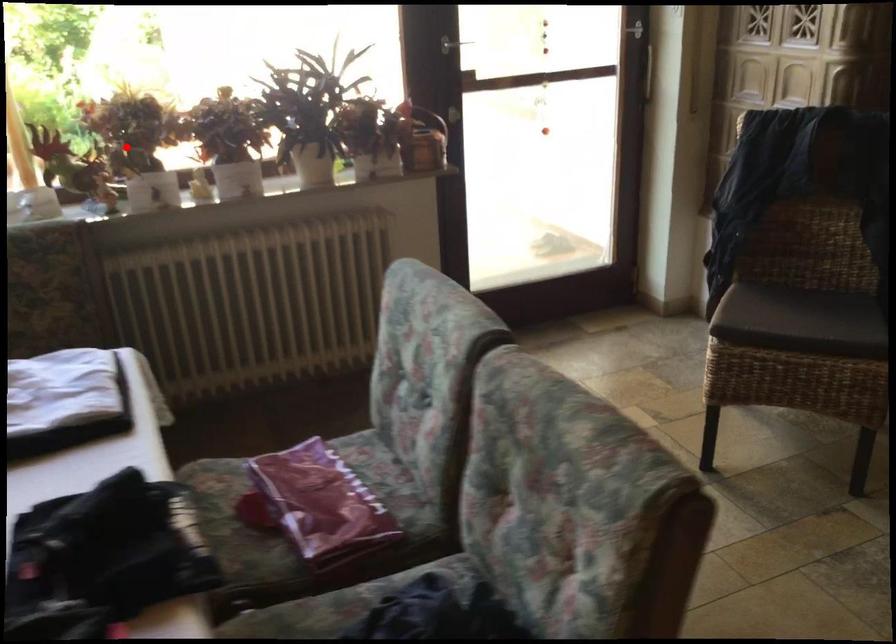
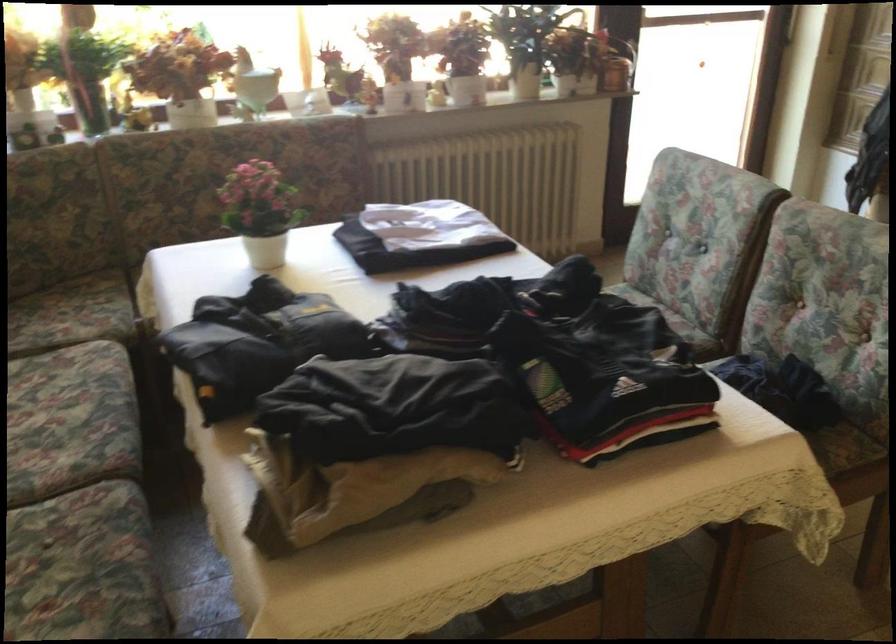
Question: I am providing you with two images of the same scene from different viewpoints. A red point is shown in image1. For the corresponding object point in image2, is it positioned nearer or farther from the camera?

Choices:
 (A) Nearer
 (B) Farther

Answer: (B)